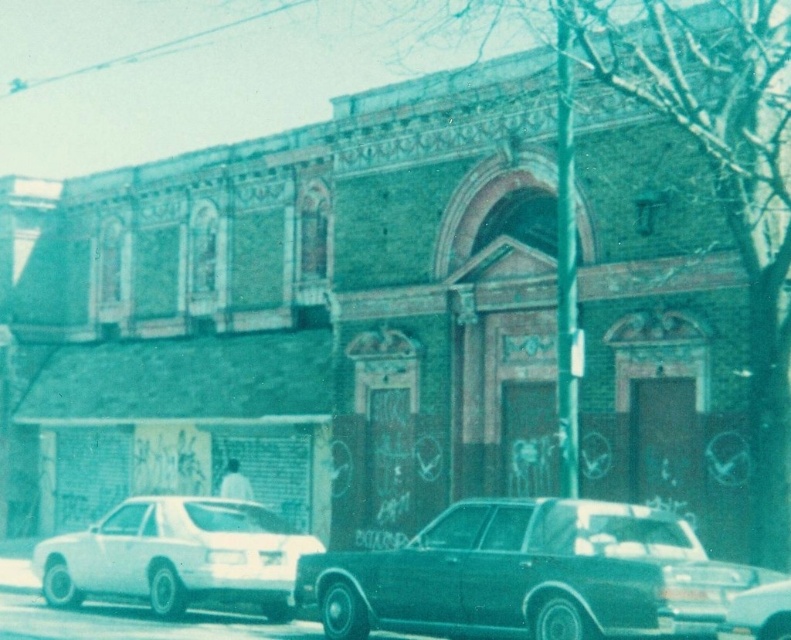
You are standing at the front of the building and want to walk to the point marked by point [672,570] and point [752,620]. Which point is closer to you?

Point [752,620] is closer to you because it is in front of point [672,570].

You are a delivery person trying to park your van, which is 1.8 meters tall, in the space between the white glossy sedan at lower left and the metallic silver sedan at center. Can your van fit vertically between them?

The white glossy sedan at lower left is taller than the metallic silver sedan at center. Since the tallest object between them is the white glossy sedan at lower left, but the exact height difference isn not provided. However, the van is 1.8 meters tall. Without knowing the minimum height clearance between the sedans, it is impossible to determine if the van can fit vertically.